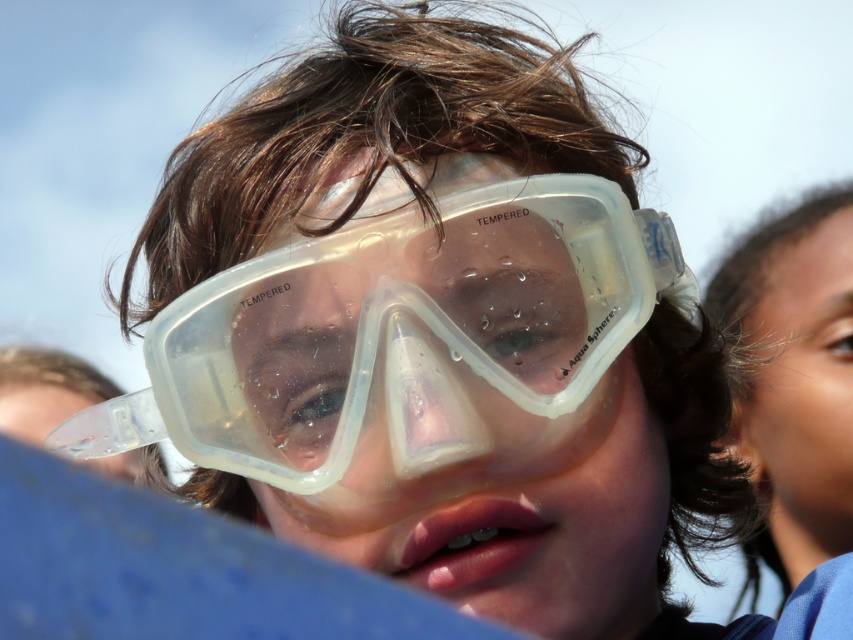
Consider the image. Is transparent plastic goggles at center smaller than smooth skin face at upper right?

Correct, transparent plastic goggles at center occupies less space than smooth skin face at upper right.

Is point (608, 340) positioned after point (766, 512)?

No.

The width and height of the screenshot is (853, 640). Find the location of `transparent plastic goggles at center`. transparent plastic goggles at center is located at coordinates (395, 333).